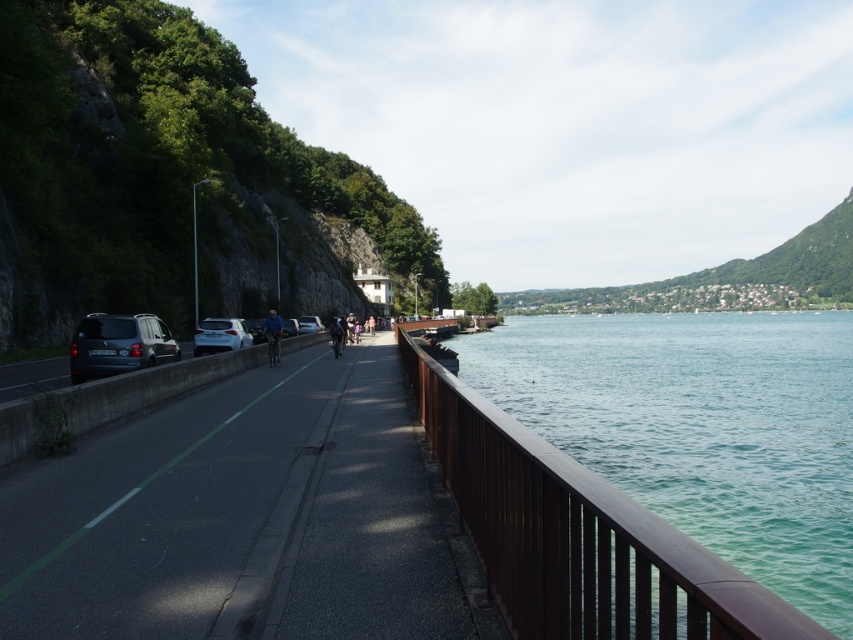
Locate an element on the screen. The height and width of the screenshot is (640, 853). matte black van at left is located at coordinates (119, 344).

Is point (80, 365) closer to viewer compared to point (241, 321)?

That is True.

At what (x,y) coordinates should I click in order to perform the action: click on matte black van at left. Please return your answer as a coordinate pair (x, y). This screenshot has height=640, width=853. Looking at the image, I should click on (119, 344).

Can you confirm if white glossy car at center-left is positioned above matte black car at center?

Actually, white glossy car at center-left is below matte black car at center.

Is white glossy car at center-left taller than matte black car at center?

No, white glossy car at center-left is not taller than matte black car at center.

Does point (201, 353) lie behind point (309, 317)?

No, (201, 353) is in front of (309, 317).

The height and width of the screenshot is (640, 853). I want to click on white glossy car at center-left, so click(219, 336).

Who is higher up, matte black van at left or blue fabric jacket at center?

blue fabric jacket at center is above.

Is matte black van at left shorter than blue fabric jacket at center?

Yes, matte black van at left is shorter than blue fabric jacket at center.

What do you see at coordinates (119, 344) in the screenshot? This screenshot has height=640, width=853. I see `matte black van at left` at bounding box center [119, 344].

The image size is (853, 640). What are the coordinates of `matte black van at left` in the screenshot? It's located at (119, 344).